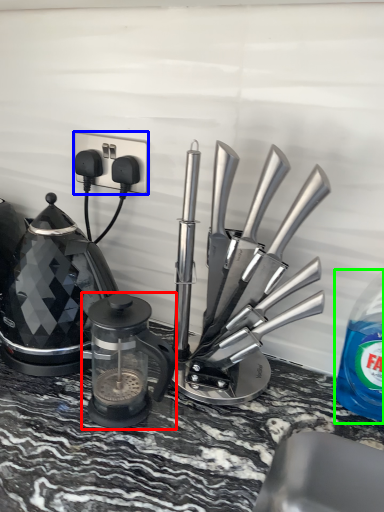
Question: Which object is positioned closest to kitchen appliance (highlighted by a red box)? Select from electric outlet (highlighted by a blue box) and bottle (highlighted by a green box).

Choices:
 (A) electric outlet
 (B) bottle

Answer: (A)